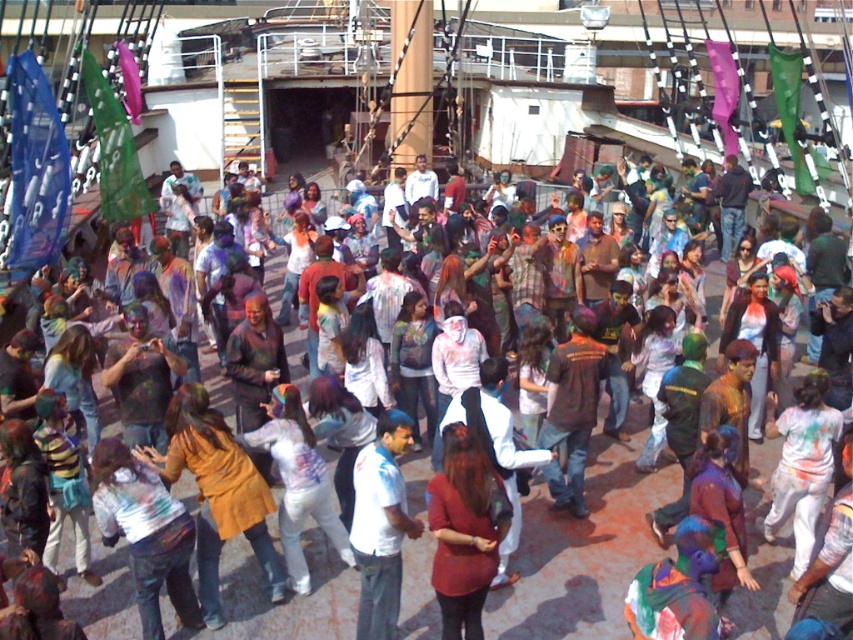
Is point (486, 570) positioned in front of point (357, 497)?

Yes, point (486, 570) is in front of point (357, 497).

Between matte red shirt at center and white cotton shirt at center, which one appears on the right side from the viewer's perspective?

From the viewer's perspective, matte red shirt at center appears more on the right side.

At what (x,y) coordinates should I click in order to perform the action: click on matte red shirt at center. Please return your answer as a coordinate pair (x, y). This screenshot has width=853, height=640. Looking at the image, I should click on (463, 531).